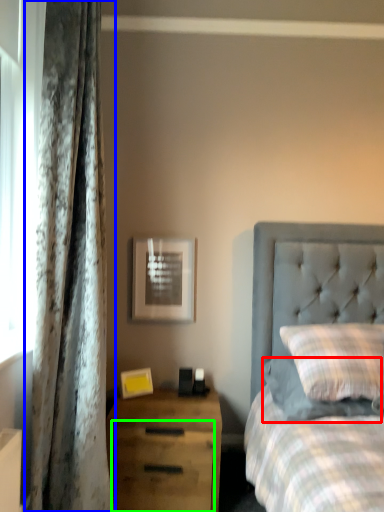
Question: Which is farther away from pillow (highlighted by a red box)? curtain (highlighted by a blue box) or drawer (highlighted by a green box)?

Choices:
 (A) curtain
 (B) drawer

Answer: (A)